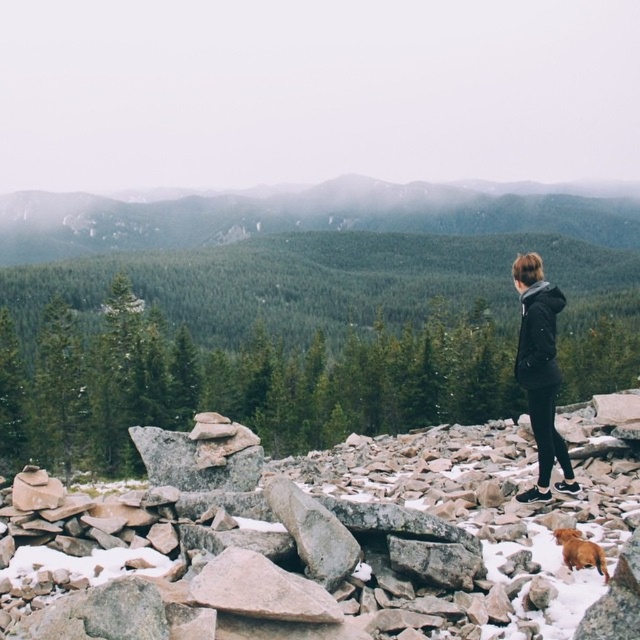
The width and height of the screenshot is (640, 640). Identify the location of smooth gray rock at center. (326, 548).

Who is more forward, (330,497) or (552,397)?

Point (330,497) is in front.

Which is behind, point (444, 516) or point (566, 461)?

Positioned behind is point (566, 461).

Find the location of a particular element. smooth gray rock at center is located at coordinates 326,548.

Measure the distance between smooth gray rock at center and brown furry dog at lower right.

A distance of 6.21 meters exists between smooth gray rock at center and brown furry dog at lower right.

Is smooth gray rock at center wider than brown furry dog at lower right?

Indeed, smooth gray rock at center has a greater width compared to brown furry dog at lower right.

Measure the distance between smooth gray rock at center and camera.

A distance of 4.66 meters exists between smooth gray rock at center and camera.

Locate an element on the screen. smooth gray rock at center is located at coordinates [x=326, y=548].

Does black matte jacket at center have a larger size compared to brown furry dog at lower right?

Yes.

Describe the element at coordinates (540, 371) in the screenshot. I see `black matte jacket at center` at that location.

Is point (522, 289) positioned in front of point (602, 570)?

That is False.

Locate an element on the screen. black matte jacket at center is located at coordinates (540, 371).